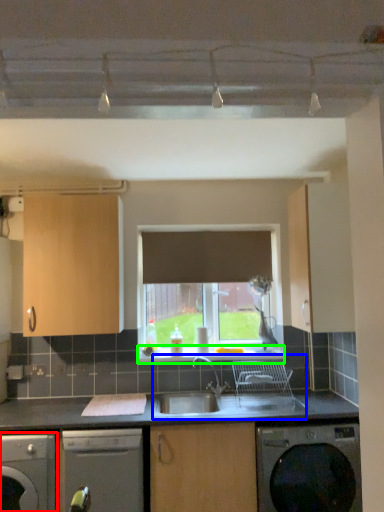
Question: Based on their relative distances, which object is nearer to dishwasher (highlighted by a red box)? Choose from sink (highlighted by a blue box) and window sill (highlighted by a green box).

Choices:
 (A) sink
 (B) window sill

Answer: (A)